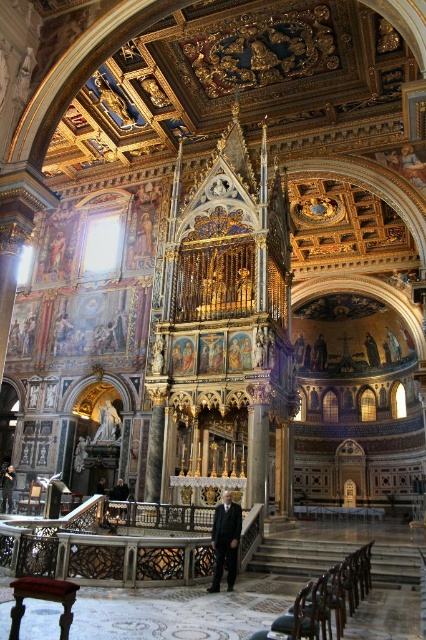
Question: Does black suit at center come behind dark suit at center?

Choices:
 (A) no
 (B) yes

Answer: (A)

Question: Among these points, which one is nearest to the camera?

Choices:
 (A) (233, 536)
 (B) (5, 492)

Answer: (A)

Question: Among these objects, which one is nearest to the camera?

Choices:
 (A) black suit at center
 (B) dark suit at center

Answer: (A)

Question: Is black suit at center thinner than dark suit at center?

Choices:
 (A) no
 (B) yes

Answer: (B)

Question: Can you confirm if black suit at center is positioned to the right of dark suit at center?

Choices:
 (A) no
 (B) yes

Answer: (B)